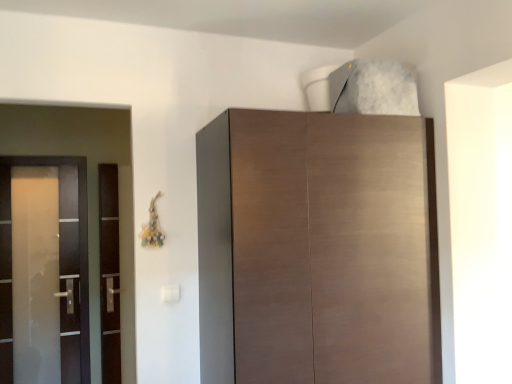
Question: From the image's perspective, relative to satin glass screen door at left, positioned as the first screen door in left-to-right order, is matte brown cabinet at upper center above or below?

Choices:
 (A) below
 (B) above

Answer: (B)

Question: Is point (245, 155) positioned closer to the camera than point (41, 289)?

Choices:
 (A) farther
 (B) closer

Answer: (B)

Question: Estimate the real-world distances between objects in this image. Which object is farther from the transparent glass door at left, which is counted as the 2th screen door, starting from the left?

Choices:
 (A) matte brown cabinet at upper center
 (B) satin glass screen door at left, marked as the 2th screen door in a right-to-left arrangement

Answer: (A)

Question: Which of these objects is positioned closest to the satin glass screen door at left, positioned as the first screen door in left-to-right order?

Choices:
 (A) matte brown cabinet at upper center
 (B) transparent glass door at left, which is the 1th screen door in right-to-left order

Answer: (B)